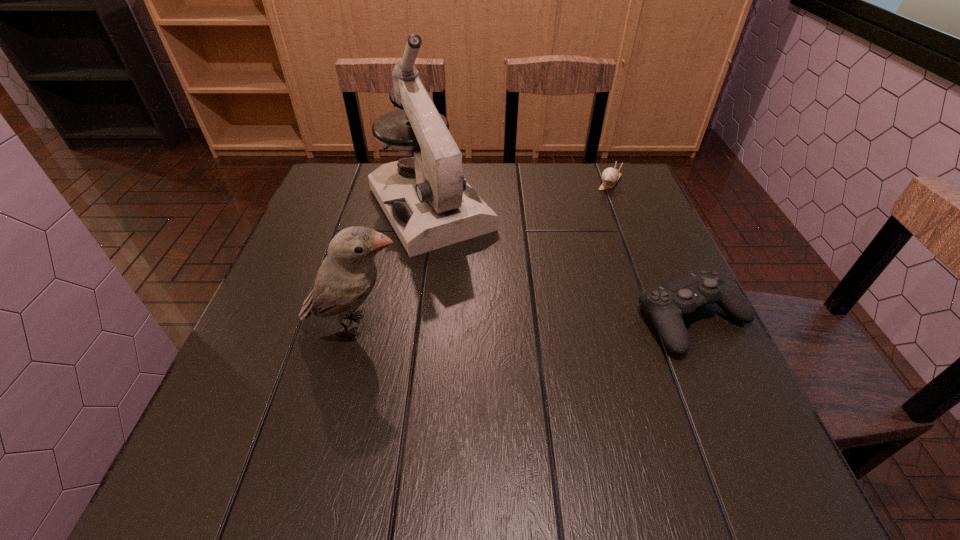
The width and height of the screenshot is (960, 540). In order to click on the third shortest object in this screenshot , I will do pos(347,275).

In order to click on control in this screenshot , I will do `click(666, 304)`.

Locate an element on the screen. microscope is located at coordinates click(428, 202).

At what (x,y) coordinates should I click in order to perform the action: click on the shortest object. Please return your answer as a coordinate pair (x, y). This screenshot has height=540, width=960. Looking at the image, I should click on (610, 176).

Where is `free space located at the face of the bird`? This screenshot has height=540, width=960. free space located at the face of the bird is located at coordinates (553, 325).

The width and height of the screenshot is (960, 540). What are the coordinates of `vacant area situated 0.250m on the back of the third tallest object` in the screenshot? It's located at (646, 216).

At what (x,y) coordinates should I click in order to perform the action: click on vacant space situated at the eyepiece of the tallest object. Please return your answer as a coordinate pair (x, y). Looking at the image, I should click on (532, 359).

Locate an element on the screen. The image size is (960, 540). blank space located at the eyepiece of the tallest object is located at coordinates (521, 343).

The height and width of the screenshot is (540, 960). Identify the location of free space located 0.250m at the eyepiece of the tallest object. (509, 325).

Where is `vacant space situated 0.350m on the shell of the shortest object`? vacant space situated 0.350m on the shell of the shortest object is located at coordinates (558, 264).